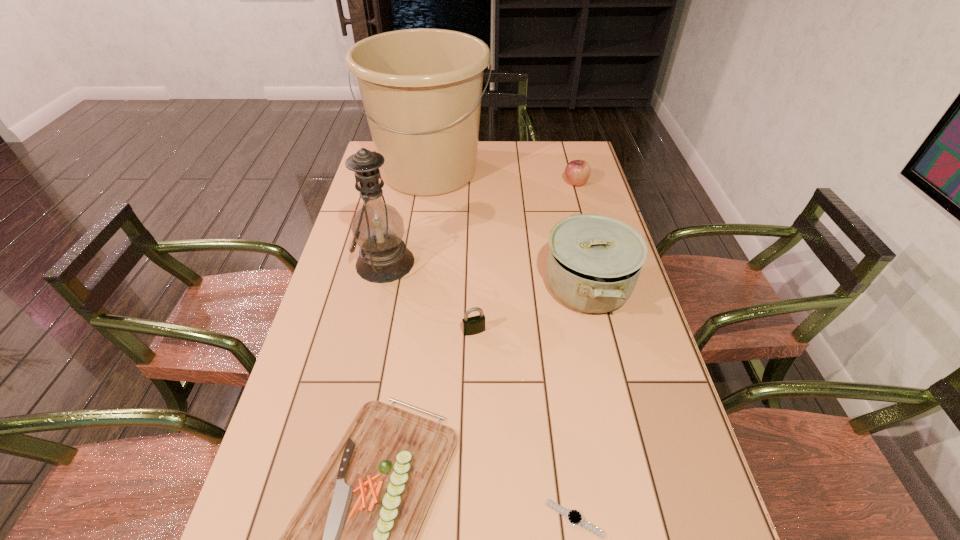
This screenshot has height=540, width=960. I want to click on vacant space that satisfies the following two spatial constraints: 1. on the front side of the bucket; 2. on the right side of the apple, so click(x=427, y=183).

The height and width of the screenshot is (540, 960). In order to click on vacant space that satisfies the following two spatial constraints: 1. on the front side of the saucepan; 2. on the left side of the second tallest object in this screenshot , I will do `click(380, 287)`.